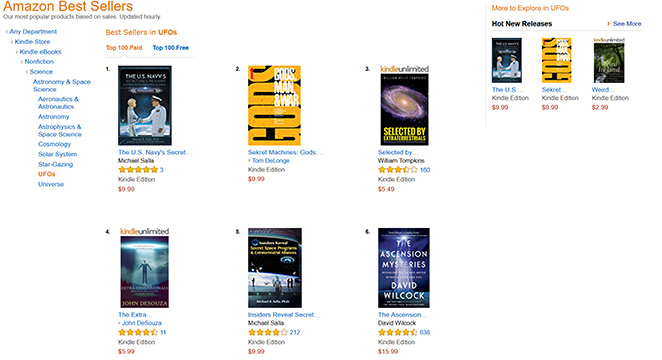
Locate an element on the screen. The width and height of the screenshot is (662, 360). books is located at coordinates (148, 107), (277, 105), (402, 109), (508, 56), (563, 56), (606, 59), (408, 263), (277, 263), (145, 277).